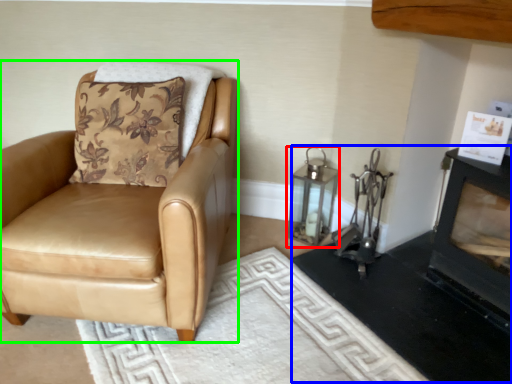
Question: Considering the real-world distances, which object is farthest from lantern (highlighted by a red box)? fireplace (highlighted by a blue box) or chair (highlighted by a green box)?

Choices:
 (A) fireplace
 (B) chair

Answer: (B)